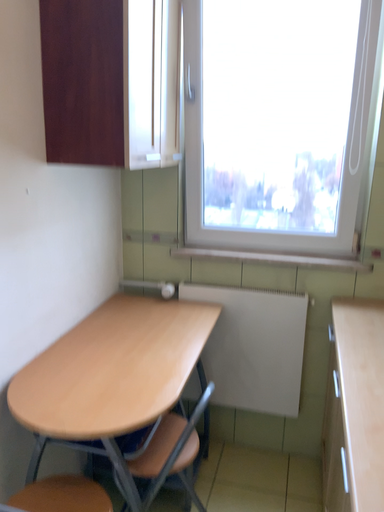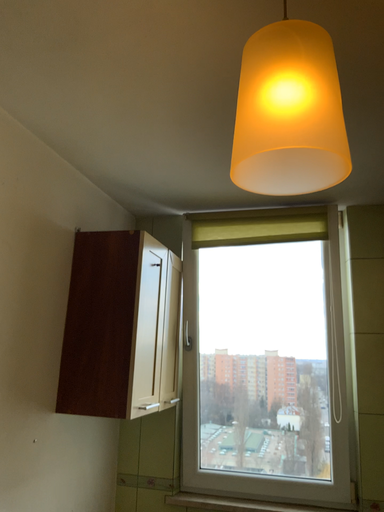
Question: Which way did the camera rotate in the video?

Choices:
 (A) rotated upward
 (B) rotated downward

Answer: (A)